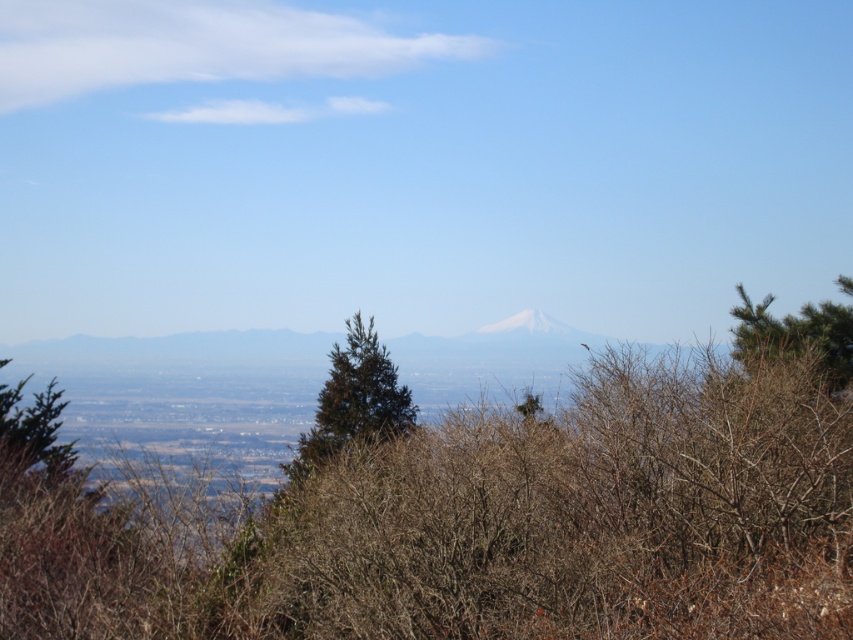
You are standing at the point closer to the camera between the two points, point (799, 321) and point (497, 326). Looking towards the distant mountain, which direction should you turn to face the other point?

You should turn to your right to face the point (497, 326) because it is further away from the camera compared to point (799, 321).